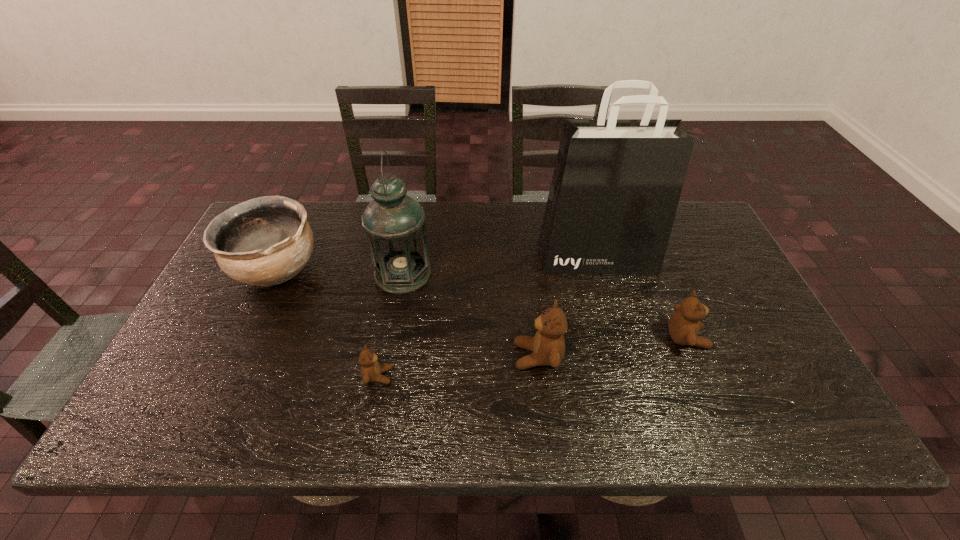
The teddy bears are evenly distributed in the image. To maintain this, where would you place another teddy bear on the left? Please point to a free space. Please provide its 2D coordinates. Your answer should be formatted as a tuple, i.e. [(x, y)], where the tuple contains the x and y coordinates of a point satisfying the conditions above.

[(205, 397)]